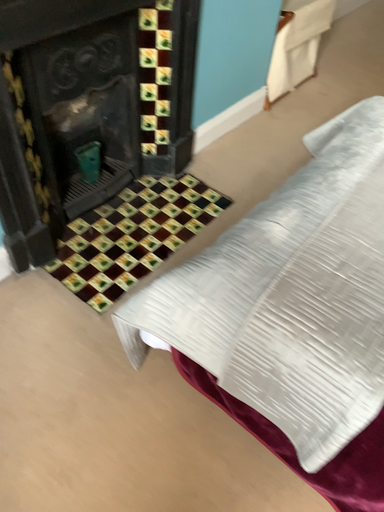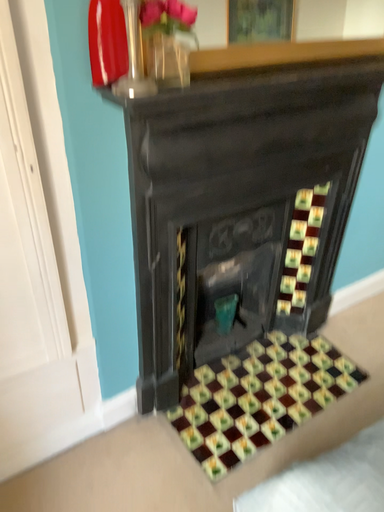
Question: How did the camera likely rotate when shooting the video?

Choices:
 (A) rotated left
 (B) rotated right

Answer: (A)